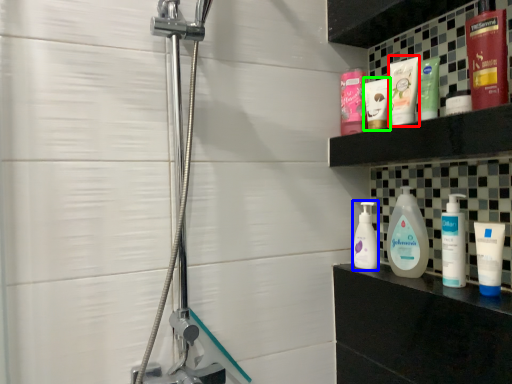
Question: Which object is the closest to the toothpaste (highlighted by a red box)? Choose among these: cleaning product (highlighted by a blue box) or toiletry (highlighted by a green box).

Choices:
 (A) cleaning product
 (B) toiletry

Answer: (B)